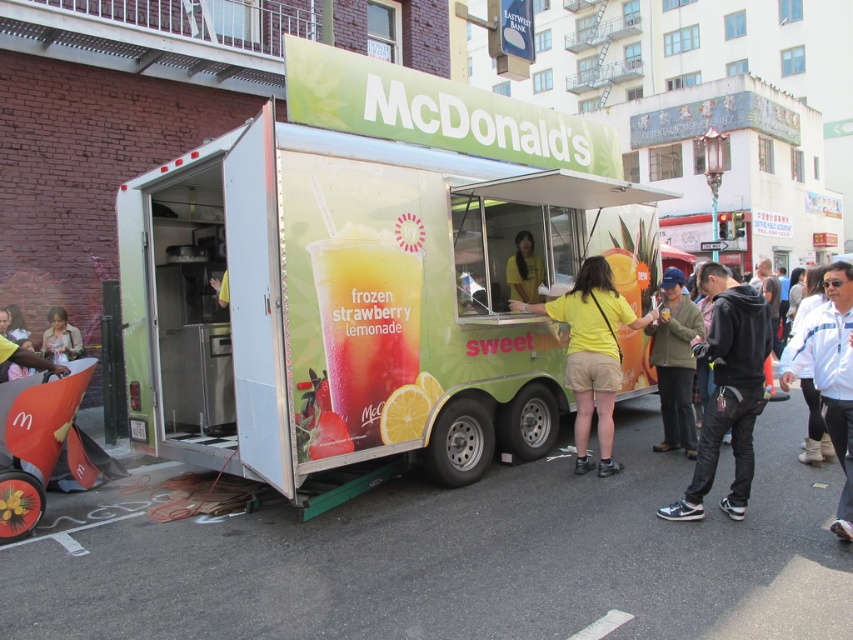
Question: Is yellow cotton shirt at center above matte plastic cup at center?

Choices:
 (A) no
 (B) yes

Answer: (A)

Question: In this image, where is matte plastic cup at center located relative to white rubber line at lower center?

Choices:
 (A) below
 (B) above

Answer: (B)

Question: Considering the real-world distances, which object is closest to the black leather jacket at lower right?

Choices:
 (A) white jacket at lower right
 (B) white rubber line at lower center
 (C) light brown leather jacket at lower left

Answer: (A)

Question: Which point is farther to the camera?

Choices:
 (A) (387, 240)
 (B) (579, 632)
 (C) (796, 339)

Answer: (A)

Question: Is matte red cart at lower left to the right of white rubber line at lower center from the viewer's perspective?

Choices:
 (A) yes
 (B) no

Answer: (B)

Question: Estimate the real-world distances between objects in this image. Which object is farther from the black leather jacket at lower right?

Choices:
 (A) yellow cotton shirt at center
 (B) green textured jacket at center
 (C) white jacket at lower right
 (D) yellow matte shirt at center

Answer: (D)